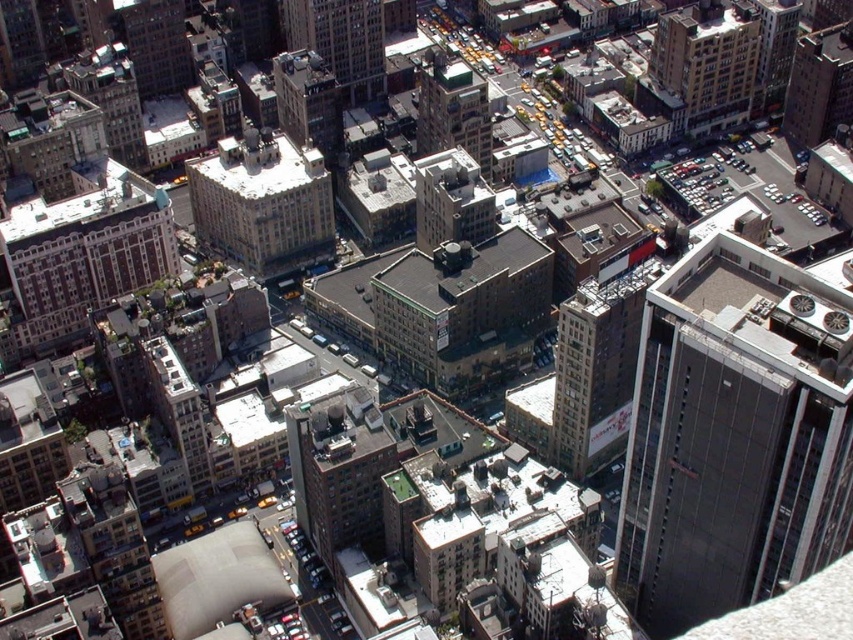
You are a drone operator tasked with delivering a package between two specific points in a city. The first point is at coordinate point (741, 504). You need to fly from the first point to the second point. Given that your drone has a maximum flight range of 750 feet, will it be able to reach the second point without recharging?

The two points are 763.69 feet apart. Since the drone has a maximum flight range of 750 feet, it will not be able to reach the second point without recharging.

You are a drone operator tasked with capturing aerial footage of the city. You need to ensure that the white stone building at center and the green glass building at center are both visible in the shot. Given their heights, which building should you position the camera to focus on first to ensure both are captured adequately?

The white stone building at center is taller than the green glass building at center. To ensure both are visible in the shot, you should position the camera to focus on the white stone building at center first, as its greater height may require adjusting the angle to include both structures appropriately.

You are a drone operator flying a drone over the city. You need to navigate between two points marked as point (677, 540) and point (741, 116). From the perspective of someone looking at the city from above, which point is closer to the front of the city layout?

Point (677, 540) is in front of point (741, 116), so it is closer to the front of the city layout.